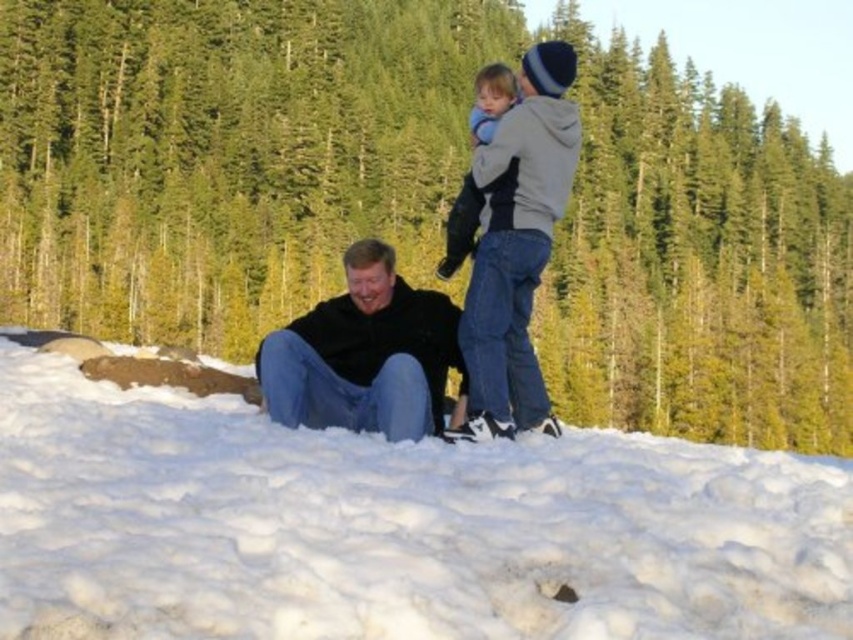
Question: Is light blue denim jeans at upper right to the left of light blue fleece jacket at upper center from the viewer's perspective?

Choices:
 (A) no
 (B) yes

Answer: (B)

Question: Which point appears closest to the camera in this image?

Choices:
 (A) (262, 65)
 (B) (618, 572)
 (C) (550, 173)
 (D) (474, 136)

Answer: (B)

Question: Among these objects, which one is nearest to the camera?

Choices:
 (A) light blue denim jeans at upper right
 (B) white fluffy snow at lower center

Answer: (B)

Question: Is white fluffy snow at lower center to the left of black matte jacket at lower center from the viewer's perspective?

Choices:
 (A) yes
 (B) no

Answer: (A)

Question: Which point is closer to the camera?

Choices:
 (A) (335, 436)
 (B) (486, 81)
 (C) (341, 173)
 (D) (403, 349)

Answer: (A)

Question: Can you confirm if light blue denim jeans at upper right is wider than light blue fleece jacket at upper center?

Choices:
 (A) no
 (B) yes

Answer: (A)